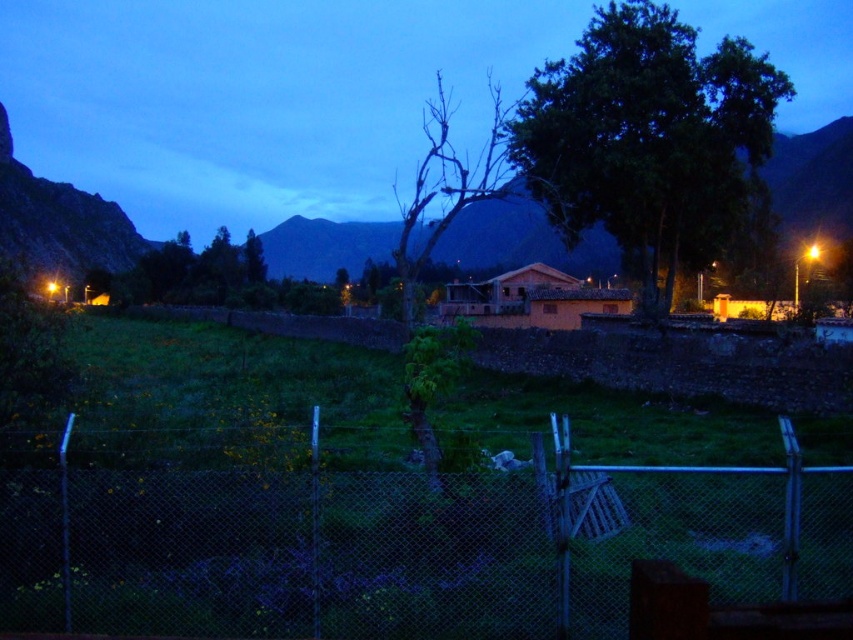
You are a landscape architect planning to plant a new tree in the field. You notice the green leafy tree at center and the green leafy tree at upper center. Which tree has a wider canopy? Please consider their widths as described.

The green leafy tree at center has a wider canopy than the green leafy tree at upper center because its width surpasses the other.

You are standing at the wooden gate of the chain link fence in the rural scene. You notice two points marked in the image. The first point is at coordinate point (663, 122) and the second is at point (432, 230). Which point is closer to you as you stand at the gate?

Point (663, 122) is in front of point (432, 230), so the first point is closer to you as you stand at the wooden gate.